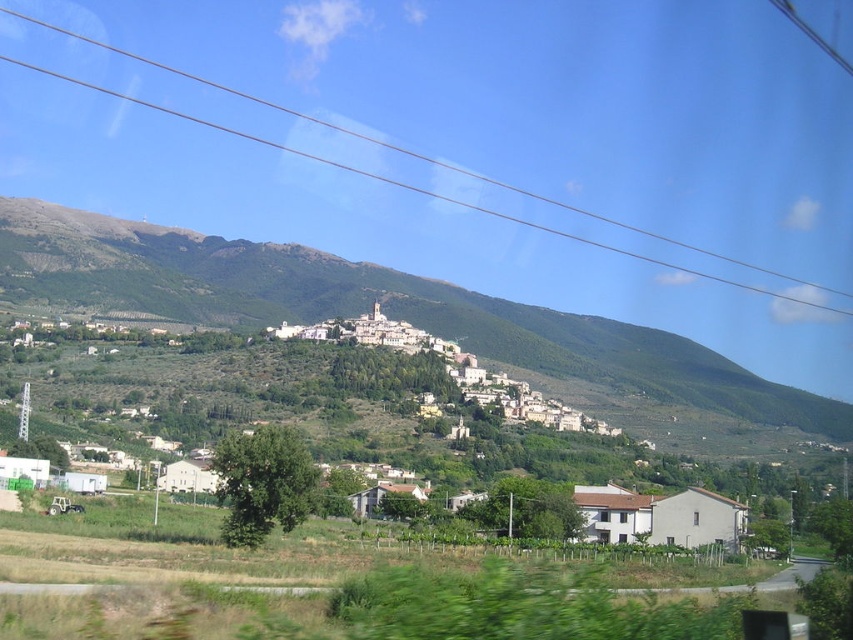
You are a drone operator planning to capture aerial footage of the white stone village at center and the transparent glass power lines at upper center. Based on their spatial relationship in the image, which object would require a wider shot to fully capture in the frame?

The transparent glass power lines at upper center require a wider shot because they occupy more space in the image than the white stone village at center.

You are a drone operator flying over the rural landscape. Your drone is currently above the white stone village at center and needs to ascend to avoid the transparent glass power lines at upper center. Should you fly upwards or sideways to safely navigate around them?

The white stone village at center is located below the transparent glass power lines at upper center, so to avoid the power lines, the drone should ascend upwards to safely navigate above them.